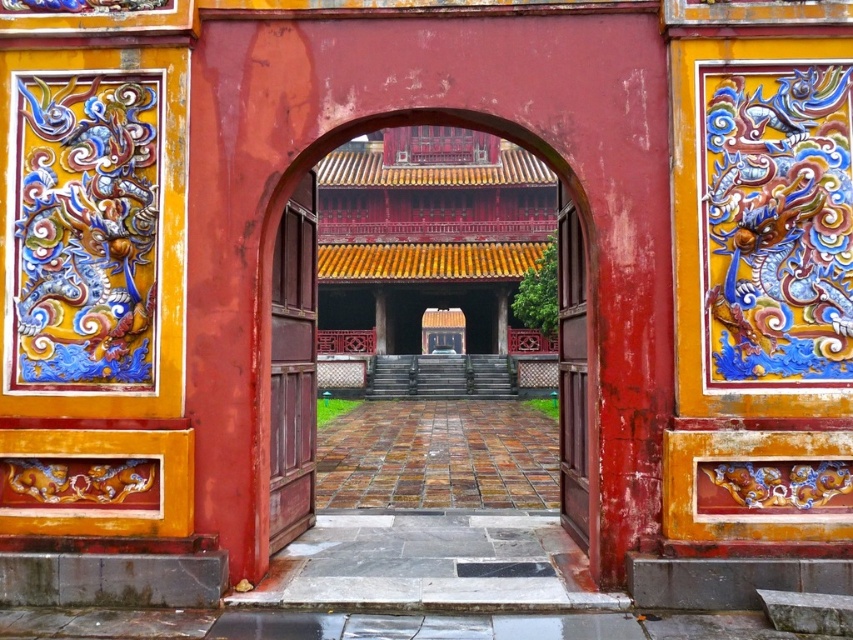
Between point (358, 163) and point (279, 392), which one is positioned behind?

Point (358, 163)

Does point (413, 280) lie behind point (279, 417)?

Yes, it is behind point (279, 417).

Find the location of a particular element. Image resolution: width=853 pixels, height=640 pixels. polished wood door at center is located at coordinates (428, 243).

How far apart are polished wood door at center and smooth wood door at center?

7.11 meters

Can you confirm if polished wood door at center is shorter than smooth wood door at center?

In fact, polished wood door at center may be taller than smooth wood door at center.

What do you see at coordinates (428, 243) in the screenshot? The image size is (853, 640). I see `polished wood door at center` at bounding box center [428, 243].

You are a GUI agent. You are given a task and a screenshot of the screen. Output one action in this format:
    pyautogui.click(x=<x>, y=<y>)
    Task: Click on the polished wood door at center
    Image resolution: width=853 pixels, height=640 pixels.
    Given the screenshot: What is the action you would take?
    428,243

Image resolution: width=853 pixels, height=640 pixels. What do you see at coordinates (293, 368) in the screenshot?
I see `wooden door at center` at bounding box center [293, 368].

Can you confirm if wooden door at center is thinner than smooth wood door at center?

Indeed, wooden door at center has a lesser width compared to smooth wood door at center.

Is point (283, 326) positioned behind point (561, 230)?

No, it is in front of (561, 230).

Where is `wooden door at center`? This screenshot has height=640, width=853. wooden door at center is located at coordinates (293, 368).